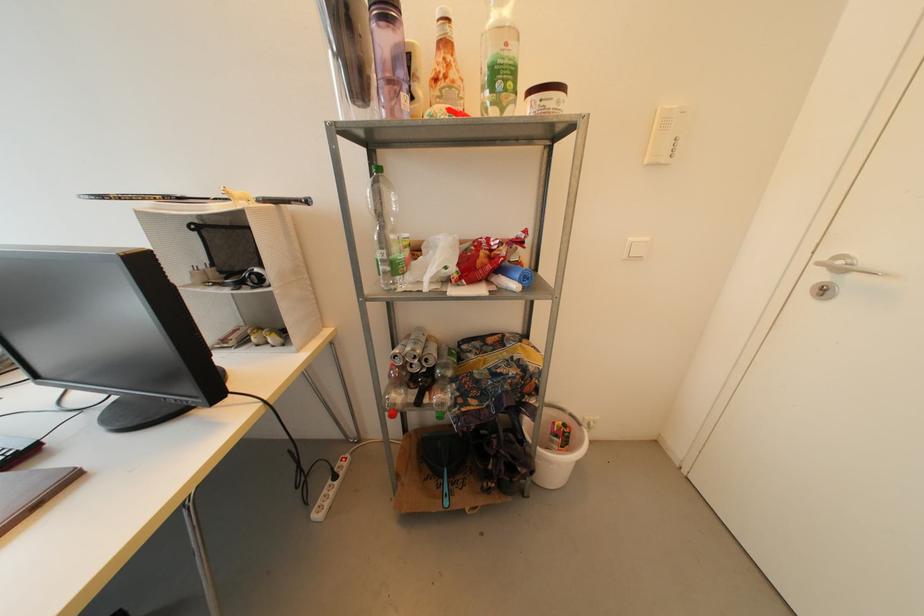
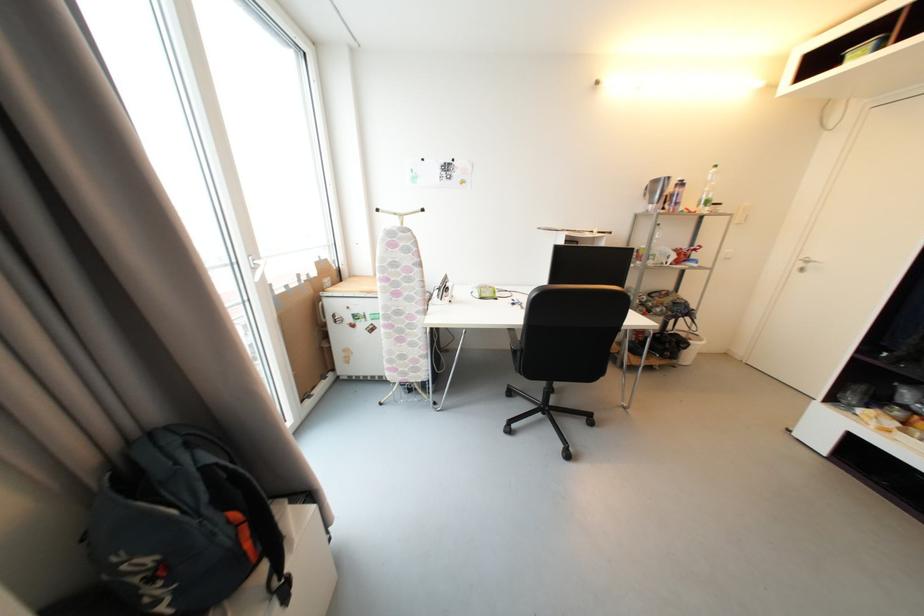
Find the pixel in the second image that matches (492,95) in the first image.

(707, 208)